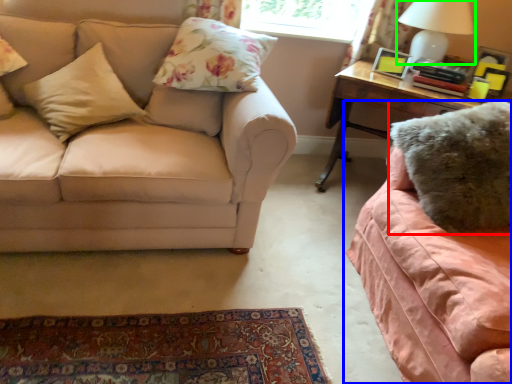
Question: Which object is the farthest from pillow (highlighted by a red box)? Choose among these: studio couch (highlighted by a blue box) or table lamp (highlighted by a green box).

Choices:
 (A) studio couch
 (B) table lamp

Answer: (B)